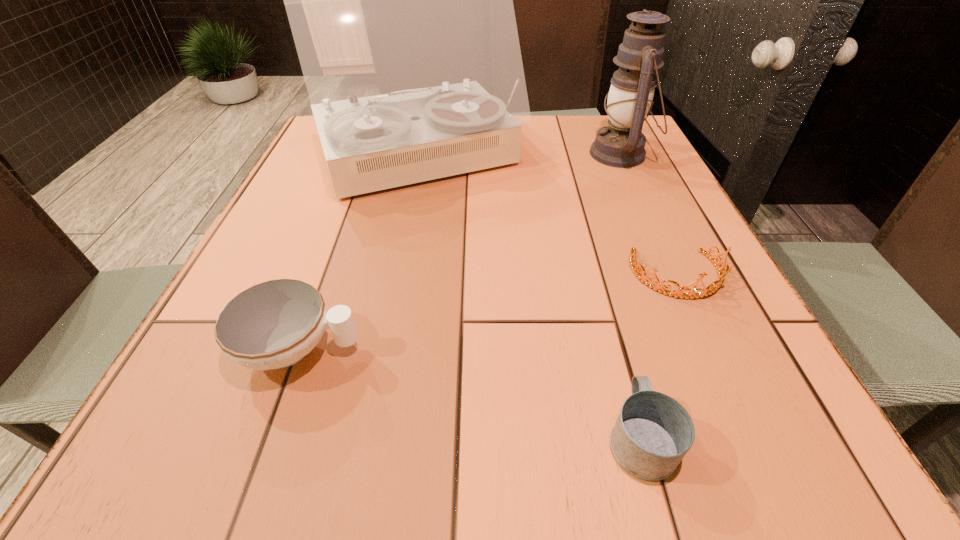
You are a GUI agent. You are given a task and a screenshot of the screen. Output one action in this format:
    pyautogui.click(x=<x>, y=<y>)
    Task: Click on the free point between the second nearest object and the third object from left to right
    Image resolution: width=960 pixels, height=540 pixels.
    Given the screenshot: What is the action you would take?
    pyautogui.click(x=469, y=393)

Find the location of a particular element. This screenshot has width=960, height=540. vacant area that lies between the third object from left to right and the record player is located at coordinates (530, 298).

Where is `vacant space that is in between the tiara and the chinaware`? This screenshot has height=540, width=960. vacant space that is in between the tiara and the chinaware is located at coordinates (489, 312).

Locate an element on the screen. vacant space in between the third object from right to left and the third farthest object is located at coordinates (659, 356).

Where is `free space between the tiara and the record player`? free space between the tiara and the record player is located at coordinates (548, 217).

Find the location of a particular element. The width and height of the screenshot is (960, 540). free space between the nearest object and the record player is located at coordinates (530, 298).

The image size is (960, 540). Identify the location of object that is the fourth closest to the chinaware. (621, 144).

Where is `object that is the closest to the third nearest object`? object that is the closest to the third nearest object is located at coordinates (653, 432).

Where is `free space in the image that satisfies the following two spatial constraints: 1. on the side with the handle of the chinaware; 2. on the side of the nearest object with the handle`? free space in the image that satisfies the following two spatial constraints: 1. on the side with the handle of the chinaware; 2. on the side of the nearest object with the handle is located at coordinates (268, 437).

Image resolution: width=960 pixels, height=540 pixels. Find the location of `free spot that satisfies the following two spatial constraints: 1. on the side of the mug with the handle; 2. on the left side of the fourth shortest object`. free spot that satisfies the following two spatial constraints: 1. on the side of the mug with the handle; 2. on the left side of the fourth shortest object is located at coordinates (564, 154).